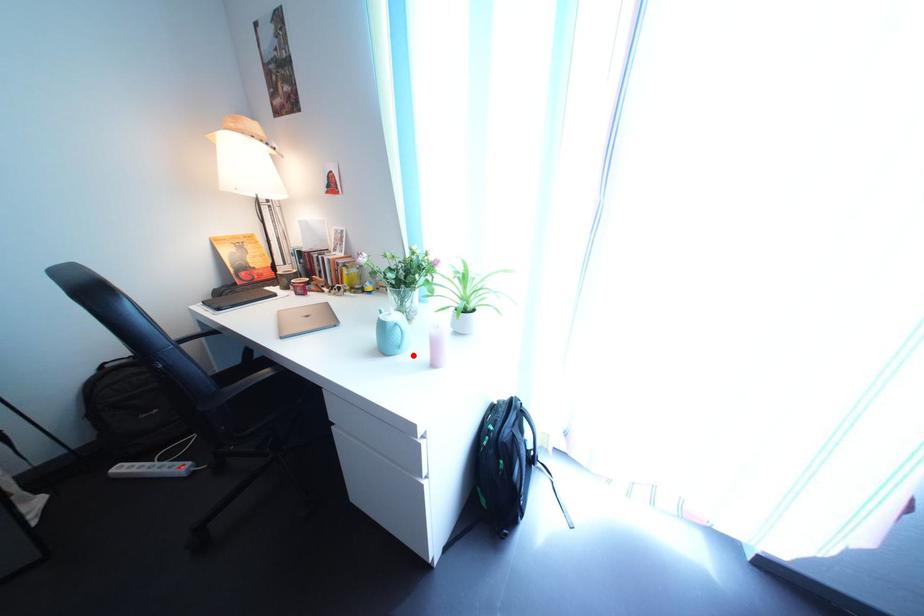
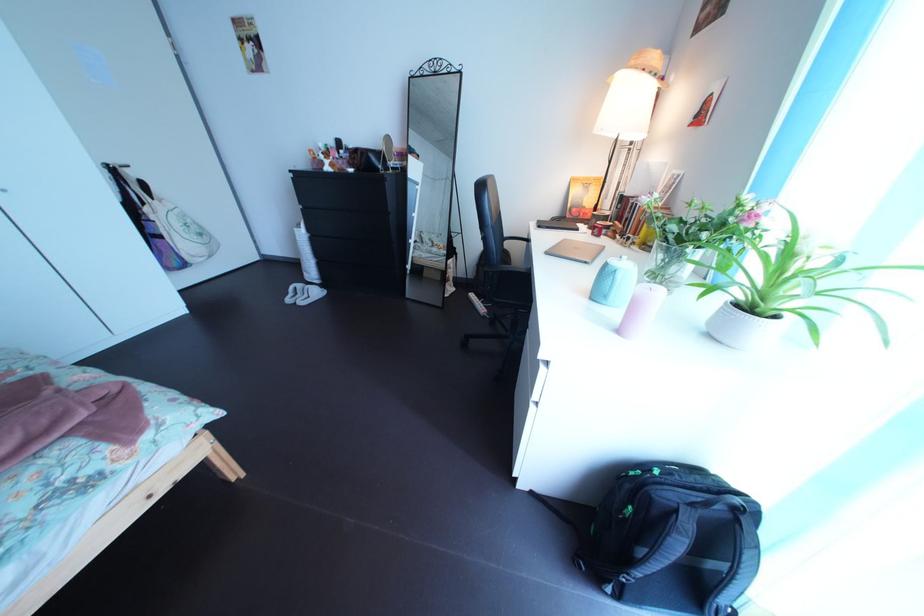
Locate, in the second image, the point that corresponds to the highlighted location in the first image.

(621, 305)